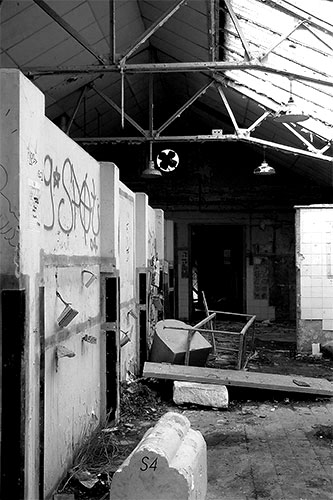
Where is `tiled wall`? tiled wall is located at coordinates (315, 235), (321, 310), (261, 313), (252, 306), (183, 289).